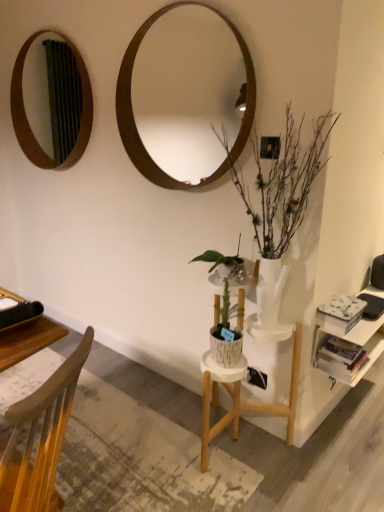
Image resolution: width=384 pixels, height=512 pixels. I want to click on blank space above white matte book at right, the 2th book ordered from the bottom (from a real-world perspective), so click(x=339, y=301).